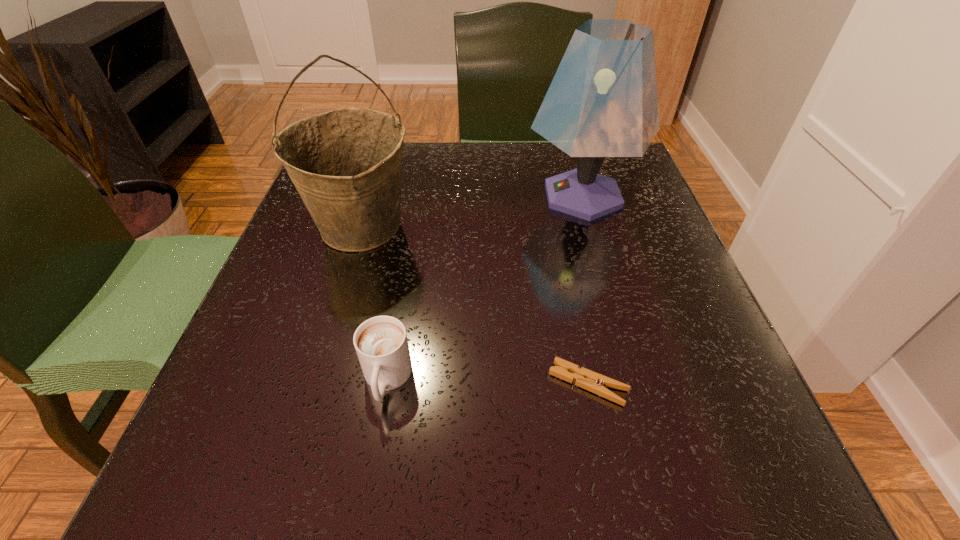
This screenshot has height=540, width=960. I want to click on vacant area that lies between the cappuccino and the clothespin, so click(488, 382).

You are a GUI agent. You are given a task and a screenshot of the screen. Output one action in this format:
    pyautogui.click(x=<x>, y=<y>)
    Task: Click on the blank region between the third tallest object and the clothespin
    The width and height of the screenshot is (960, 540).
    Given the screenshot: What is the action you would take?
    pyautogui.click(x=488, y=382)

Point out which object is positioned as the nearest to the shortest object. Please provide its 2D coordinates. Your answer should be formatted as a tuple, i.e. [(x, y)], where the tuple contains the x and y coordinates of a point satisfying the conditions above.

[(381, 344)]

Choose which object is the second nearest neighbor to the cappuccino. Please provide its 2D coordinates. Your answer should be formatted as a tuple, i.e. [(x, y)], where the tuple contains the x and y coordinates of a point satisfying the conditions above.

[(596, 383)]

Where is `free space in the image that satisfies the following two spatial constraints: 1. on the side with the handle of the third tallest object; 2. on the left side of the clothespin`? Image resolution: width=960 pixels, height=540 pixels. free space in the image that satisfies the following two spatial constraints: 1. on the side with the handle of the third tallest object; 2. on the left side of the clothespin is located at coordinates (386, 383).

Where is `free space that satisfies the following two spatial constraints: 1. on the side with the handle of the clothespin; 2. on the right side of the cappuccino`? Image resolution: width=960 pixels, height=540 pixels. free space that satisfies the following two spatial constraints: 1. on the side with the handle of the clothespin; 2. on the right side of the cappuccino is located at coordinates (386, 383).

Locate an element on the screen. The width and height of the screenshot is (960, 540). free point that satisfies the following two spatial constraints: 1. on the side with the handle of the third tallest object; 2. on the right side of the clothespin is located at coordinates (386, 383).

Image resolution: width=960 pixels, height=540 pixels. What are the coordinates of `free location that satisfies the following two spatial constraints: 1. on the side with the handle of the clothespin; 2. on the left side of the cappuccino` in the screenshot? It's located at (386, 383).

The image size is (960, 540). I want to click on free space that satisfies the following two spatial constraints: 1. on the base of the lampshade; 2. on the side with the handle of the cappuccino, so click(x=636, y=380).

You are a GUI agent. You are given a task and a screenshot of the screen. Output one action in this format:
    pyautogui.click(x=<x>, y=<y>)
    Task: Click on the vacant position in the image that satisfies the following two spatial constraints: 1. on the base of the lampshade; 2. on the front side of the clothespin
    This screenshot has height=540, width=960.
    Given the screenshot: What is the action you would take?
    [636, 383]